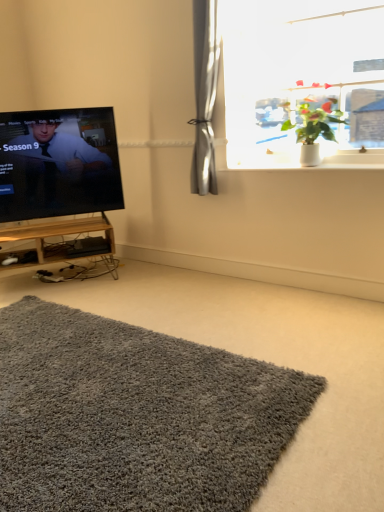
Question: Is woodenmaterial tv stand at left in front of or behind white glossy window sill at upper right in the image?

Choices:
 (A) behind
 (B) front

Answer: (A)

Question: Is woodenmaterial tv stand at left wider or thinner than white glossy window sill at upper right?

Choices:
 (A) wide
 (B) thin

Answer: (A)

Question: Estimate the real-world distances between objects in this image. Which object is farther from the black glossy tv at left?

Choices:
 (A) white glossy window sill at upper right
 (B) woodenmaterial tv stand at left
 (C) gray shaggy rug at lower center
 (D) green leafy plant at upper right
 (E) white glossy pot at upper right

Answer: (C)

Question: Which of these objects is positioned farthest from the woodenmaterial tv stand at left?

Choices:
 (A) green leafy plant at upper right
 (B) black glossy tv at left
 (C) gray shaggy rug at lower center
 (D) white glossy pot at upper right
 (E) white glossy window sill at upper right

Answer: (D)